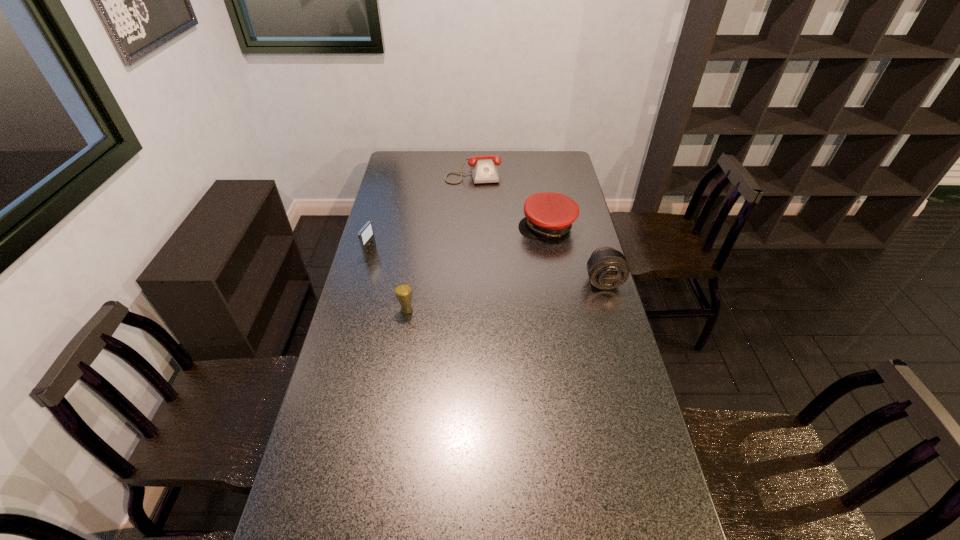
In order to click on vacant space on the desktop that is between the nearest object and the telephoto lens and is positioned on the front-facing side of the third farthest object in this screenshot , I will do `click(529, 293)`.

The image size is (960, 540). I want to click on free space on the desktop that is between the tallest object and the second nearest object and is positioned at the front of the fourth tallest object where the visor is located, so click(x=489, y=299).

Image resolution: width=960 pixels, height=540 pixels. I want to click on vacant spot on the desktop that is between the straw for drinking and the second nearest object and is positioned on the dial of the third object from right to left, so click(x=492, y=298).